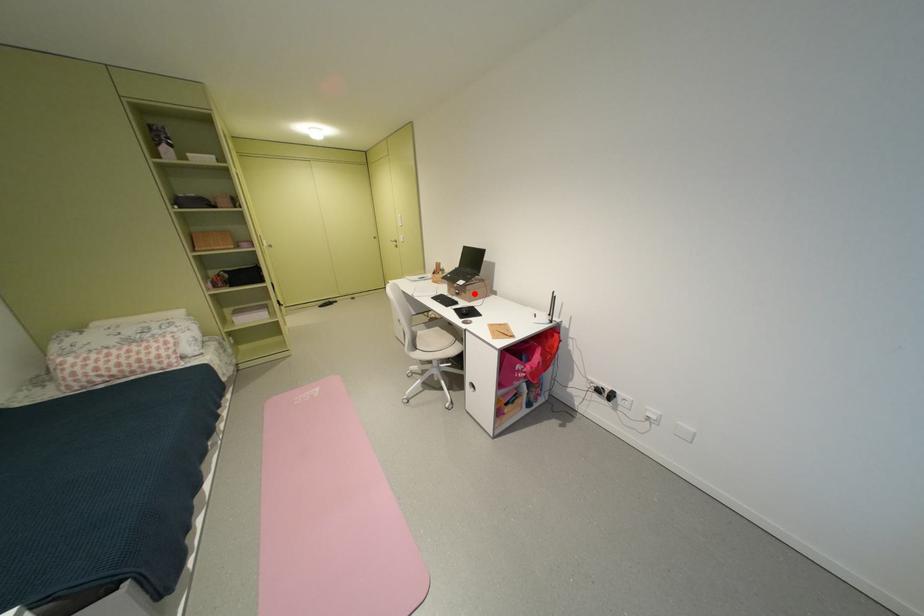
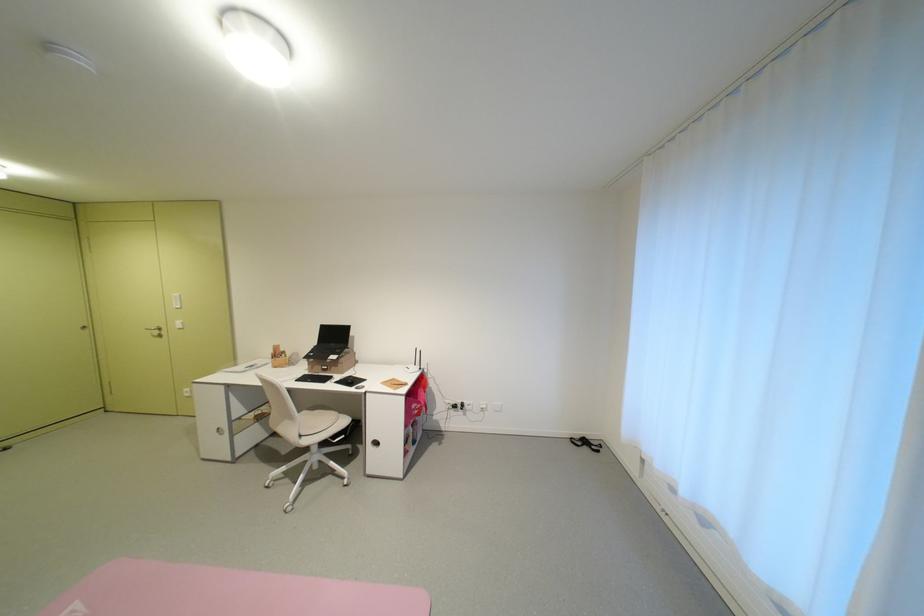
Question: A red point is marked in image1. In image2, is the corresponding 3D point closer to the camera or farther? Reply with the corresponding letter.

Choices:
 (A) The corresponding 3D point is closer.
 (B) The corresponding 3D point is farther.

Answer: (B)